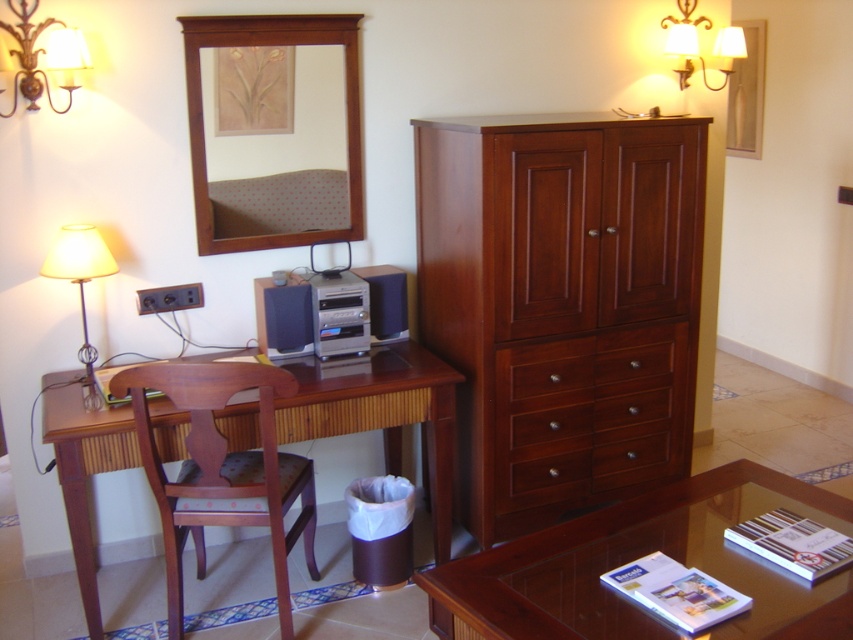
You are a guest in the room and want to place a small vase on the glossy wood coffee table at lower right. To reach it, you need to walk around the satin black speaker at center. Is the coffee table positioned to the right side of the speaker?

The glossy wood coffee table at lower right is to the right of the satin black speaker at center, so yes, the coffee table is positioned to the right side of the speaker.

You are standing in the room corner and want to locate the matte gold wall sconce at upper right. According to the coordinates provided, where exactly is it positioned?

The matte gold wall sconce at upper right is located at point 0.069 on the x axis and 0.818 on the y axis.

Consider the image. You are standing in the room and want to place a decorative vase on the closest object to you between the glossy wood coffee table at lower right and the satin black speaker at center. Which object should you choose?

The glossy wood coffee table at lower right is closer to the viewer than the satin black speaker at center, so you should place the decorative vase on the glossy wood coffee table at lower right.